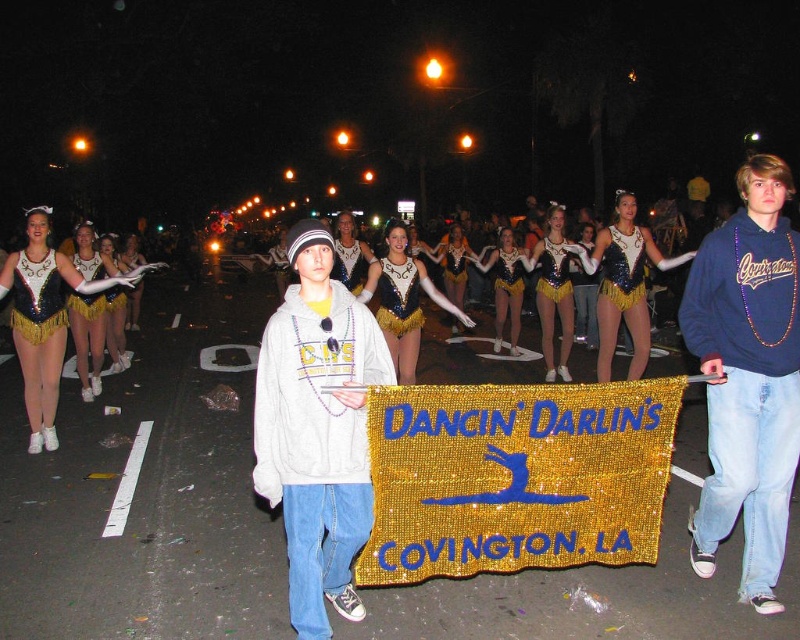
Question: Which object appears closest to the camera in this image?

Choices:
 (A) sequined gold leotard at left
 (B) shiny sequined costume at center

Answer: (A)

Question: Which point appears farthest from the camera in this image?

Choices:
 (A) [x=30, y=211]
 (B) [x=482, y=268]

Answer: (B)

Question: Does blue fleece sweatshirt at center have a smaller size compared to shiny sequined costume at center?

Choices:
 (A) yes
 (B) no

Answer: (A)

Question: Does white fleece hoodie at center appear on the left side of sequined gold leotard at left?

Choices:
 (A) yes
 (B) no

Answer: (B)

Question: Which point is closer to the camera?

Choices:
 (A) (394, 268)
 (B) (770, 600)
 (C) (509, 248)
 (D) (336, 323)

Answer: (D)

Question: Is white fleece hoodie at center above sequined gold leotard at center?

Choices:
 (A) yes
 (B) no

Answer: (B)